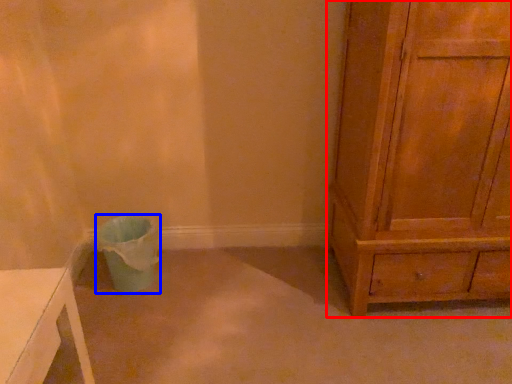
Question: Among these objects, which one is nearest to the camera, chest of drawers (highlighted by a red box) or potty (highlighted by a blue box)?

Choices:
 (A) chest of drawers
 (B) potty

Answer: (A)